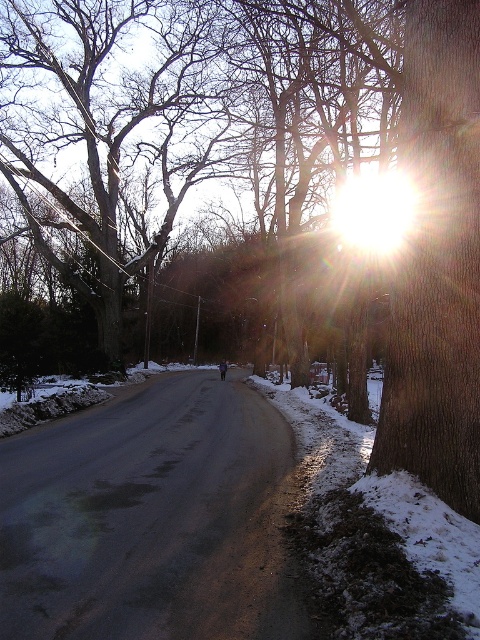
Measure the distance between smooth bark tree at left and smooth brown bark at right.

The distance of smooth bark tree at left from smooth brown bark at right is 37.70 meters.

Who is taller, smooth bark tree at left or smooth brown bark at right?

With more height is smooth bark tree at left.

In order to click on smooth bark tree at left in this screenshot , I will do `click(105, 128)`.

Find the location of a particular element. smooth bark tree at left is located at coordinates (105, 128).